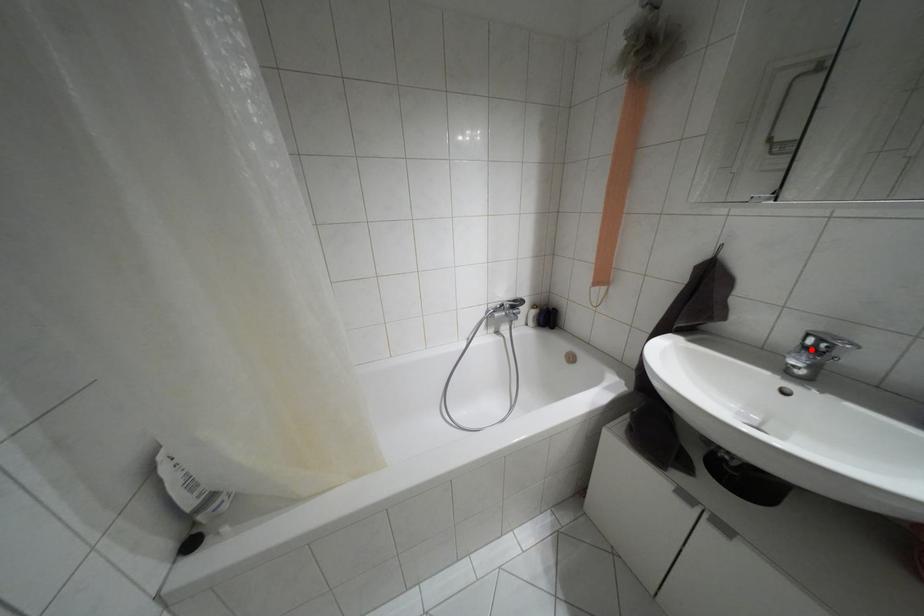
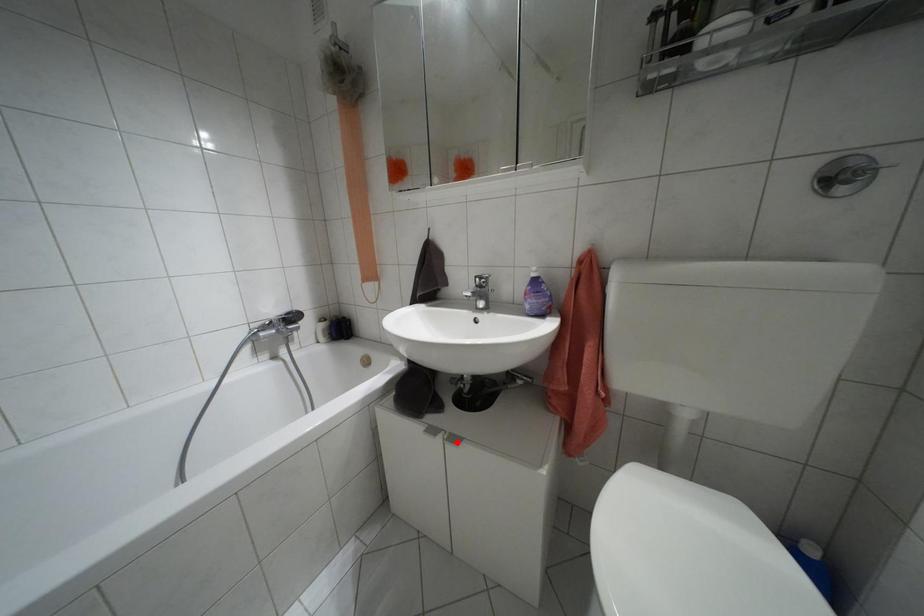
I am providing you with two images of the same scene from different viewpoints. A red point is marked on the first image and another point is marked on the second image. Are the points marked in image1 and image2 representing the same 3D position?

No